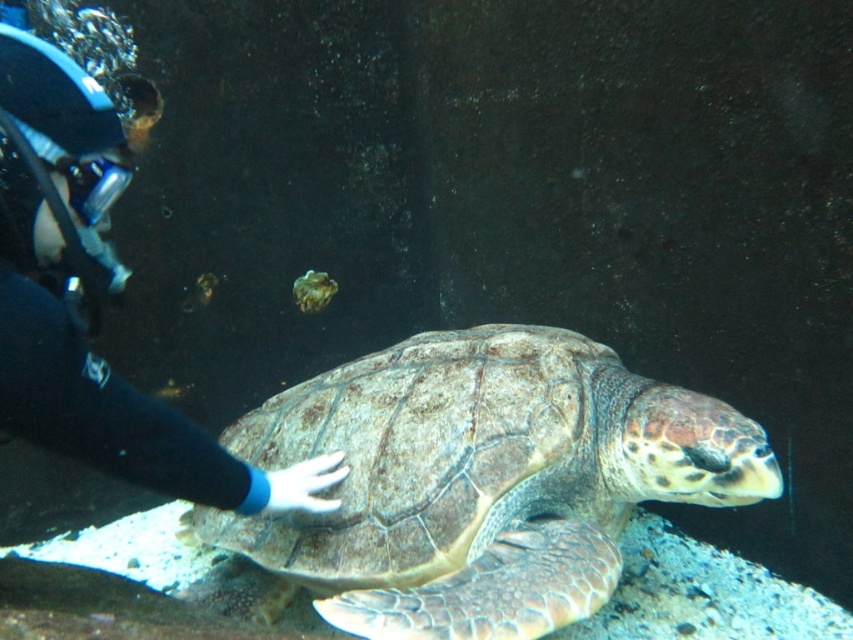
Is leathery brown turtle at center above black rubber glove at lower left?

No.

Does leathery brown turtle at center have a smaller size compared to black rubber glove at lower left?

No, leathery brown turtle at center is not smaller than black rubber glove at lower left.

At what (x,y) coordinates should I click in order to perform the action: click on leathery brown turtle at center. Please return your answer as a coordinate pair (x, y). The width and height of the screenshot is (853, 640). Looking at the image, I should click on (480, 481).